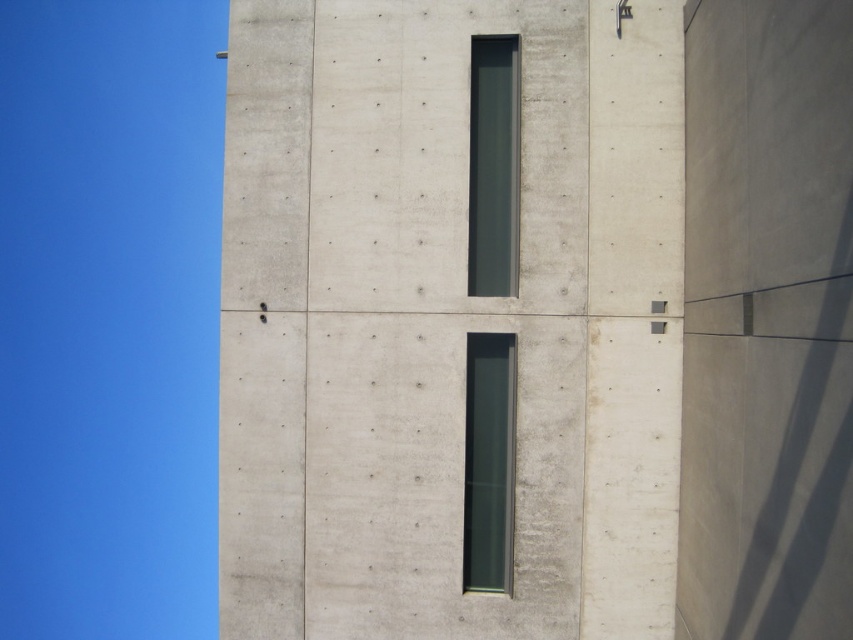
Question: Can you confirm if smooth concrete wall at center is positioned to the right of dark gray glass window at upper center?

Choices:
 (A) no
 (B) yes

Answer: (B)

Question: Among these objects, which one is farthest from the camera?

Choices:
 (A) smooth concrete wall at center
 (B) transparent glass window at center

Answer: (B)

Question: Can you confirm if smooth concrete wall at center is bigger than transparent glass window at center?

Choices:
 (A) yes
 (B) no

Answer: (B)

Question: Among these objects, which one is nearest to the camera?

Choices:
 (A) dark gray glass window at upper center
 (B) smooth concrete wall at center
 (C) transparent glass window at center

Answer: (B)

Question: Is smooth concrete wall at center below dark gray glass window at upper center?

Choices:
 (A) no
 (B) yes

Answer: (B)

Question: Which object appears farthest from the camera in this image?

Choices:
 (A) dark gray glass window at upper center
 (B) smooth concrete wall at center

Answer: (A)